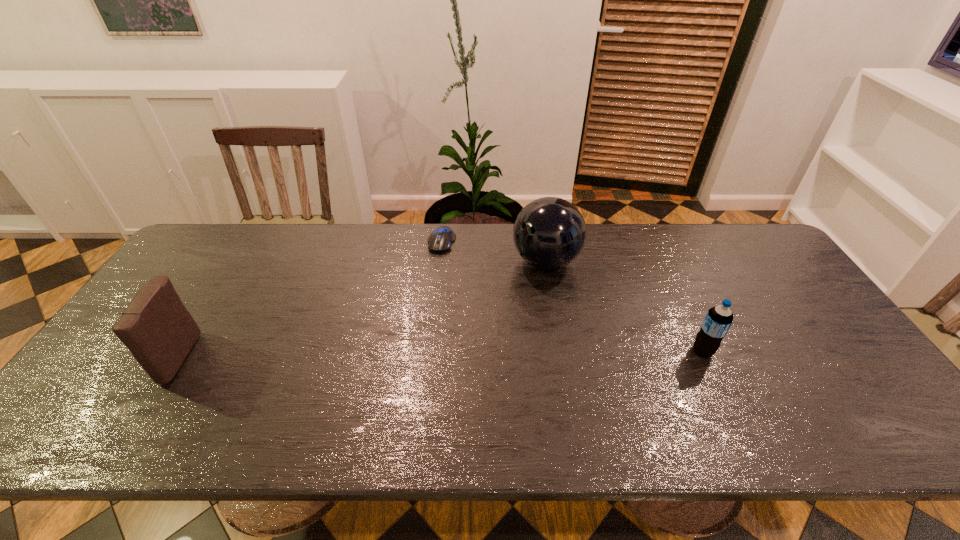
You are a GUI agent. You are given a task and a screenshot of the screen. Output one action in this format:
    pyautogui.click(x=<x>, y=<y>)
    Task: Click on the blank area located 0.230m on the button side of the second object from left to right
    
    Given the screenshot: What is the action you would take?
    pyautogui.click(x=417, y=304)

Locate an element on the screen. free space located on the button side of the second object from left to right is located at coordinates (426, 281).

You are a GUI agent. You are given a task and a screenshot of the screen. Output one action in this format:
    pyautogui.click(x=<x>, y=<y>)
    Task: Click on the vacant area situated on the side of the bowling ball with the finger holes
    
    Given the screenshot: What is the action you would take?
    pyautogui.click(x=431, y=350)

In order to click on free space located 0.330m on the side of the bowling ball with the finger holes in this screenshot , I will do `click(444, 340)`.

Find the location of a particular element. This screenshot has height=540, width=960. blank space located 0.390m on the side of the bowling ball with the finger holes is located at coordinates (428, 353).

Where is `computer mouse at the far edge`? computer mouse at the far edge is located at coordinates (440, 240).

Where is `bowling ball present at the far edge`? The image size is (960, 540). bowling ball present at the far edge is located at coordinates (549, 233).

Where is `object situated at the near edge`? object situated at the near edge is located at coordinates [x=156, y=327].

The width and height of the screenshot is (960, 540). I want to click on object present at the left edge, so click(156, 327).

I want to click on object that is at the near left corner, so click(x=156, y=327).